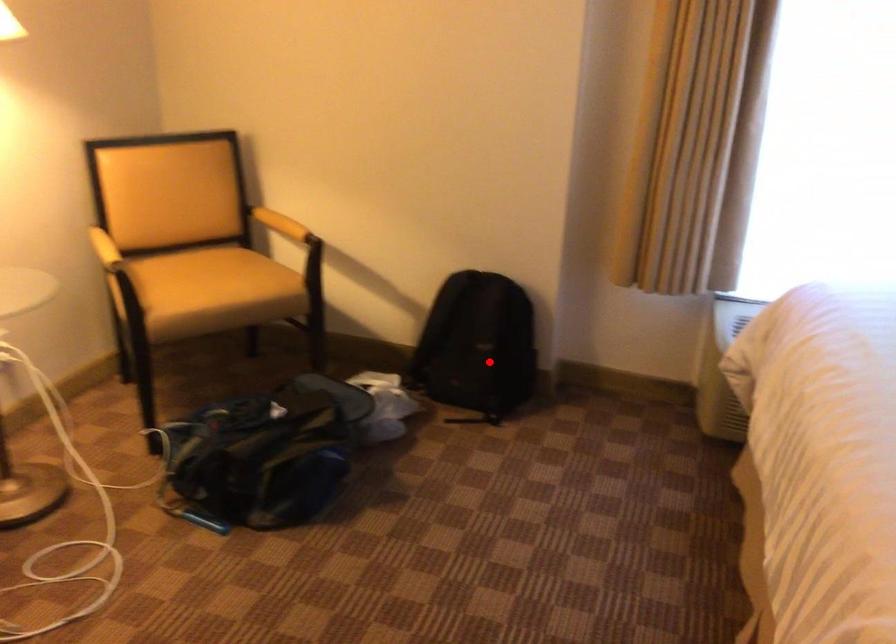
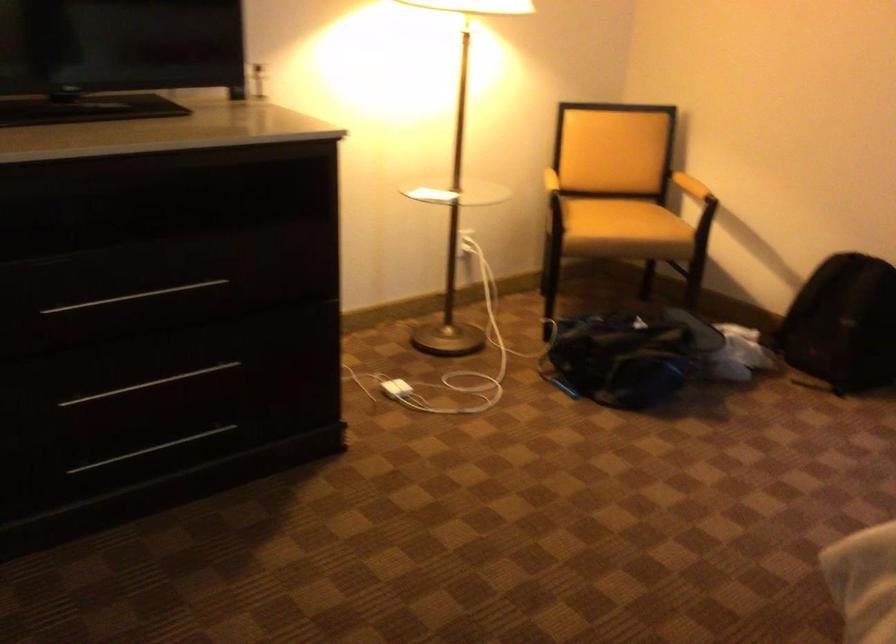
Locate, in the second image, the point that corresponds to the highlighted location in the first image.

(842, 324)